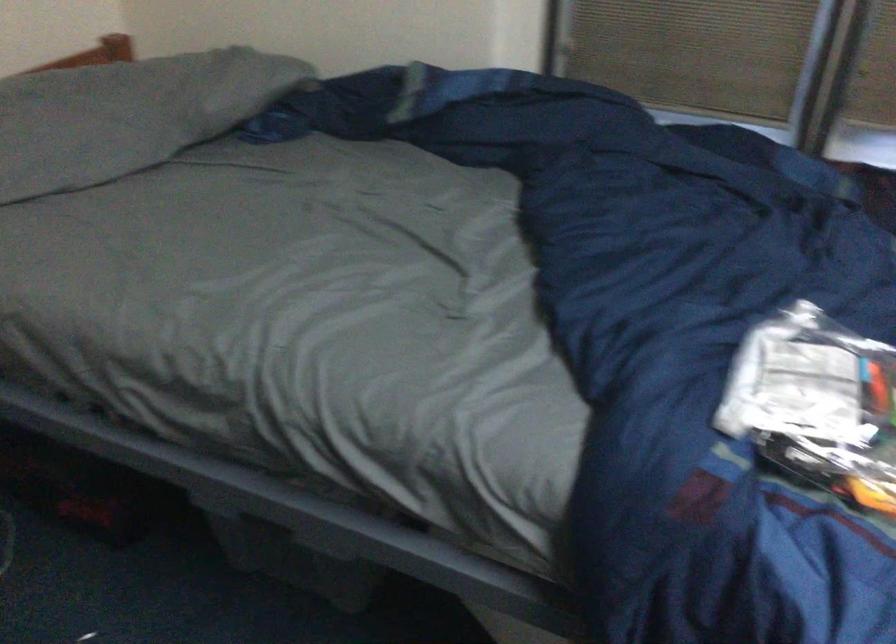
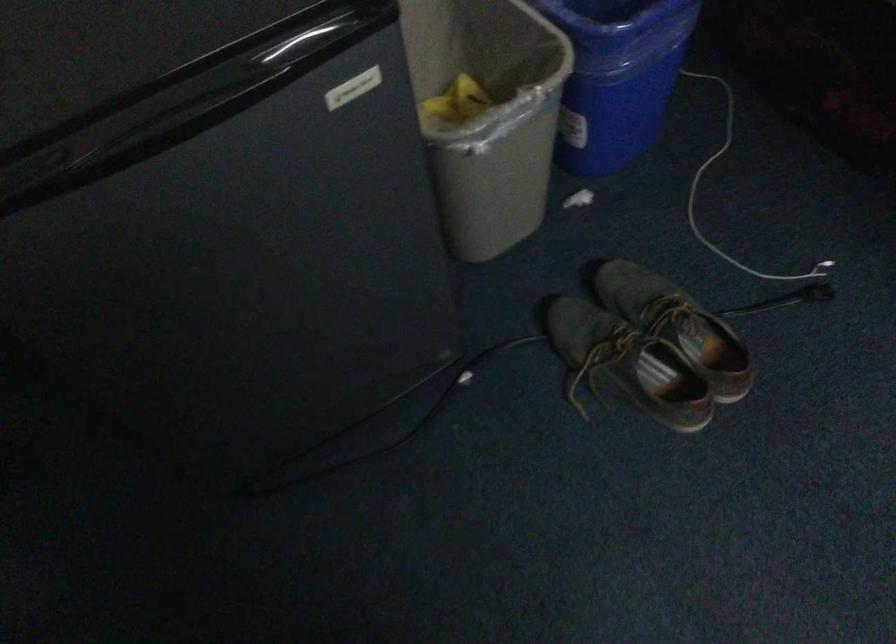
How did the camera likely rotate?

The rotation direction of the camera is left-down.